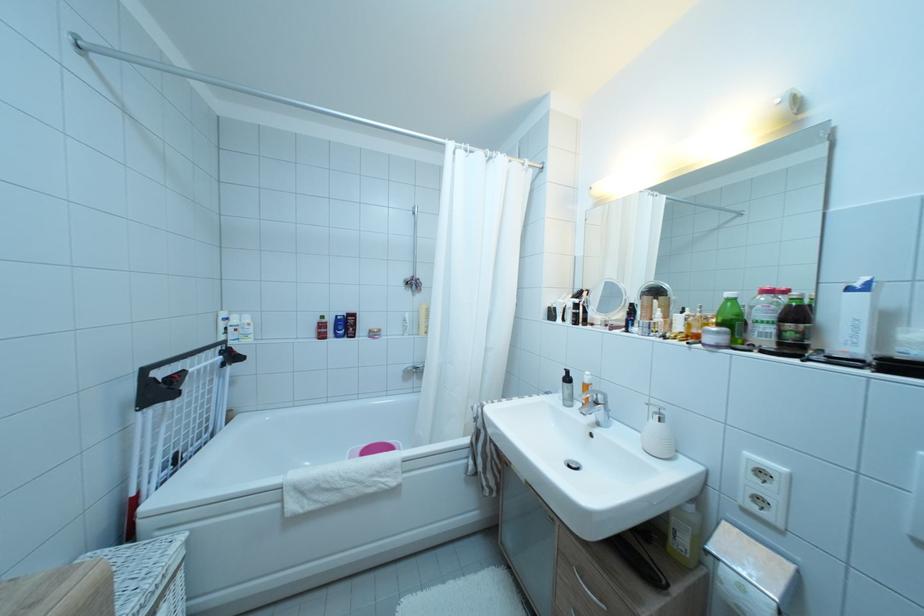
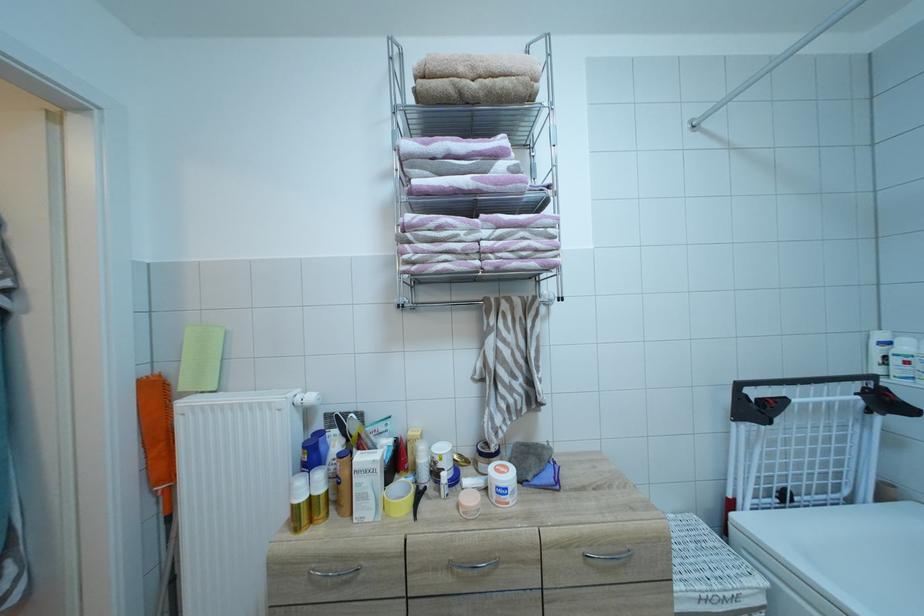
Question: The camera is either moving clockwise (left) or counter-clockwise (right) around the object. The first image is from the beginning of the video and the second image is from the end. Is the camera moving left or right when shooting the video?

Choices:
 (A) Left
 (B) Right

Answer: (B)